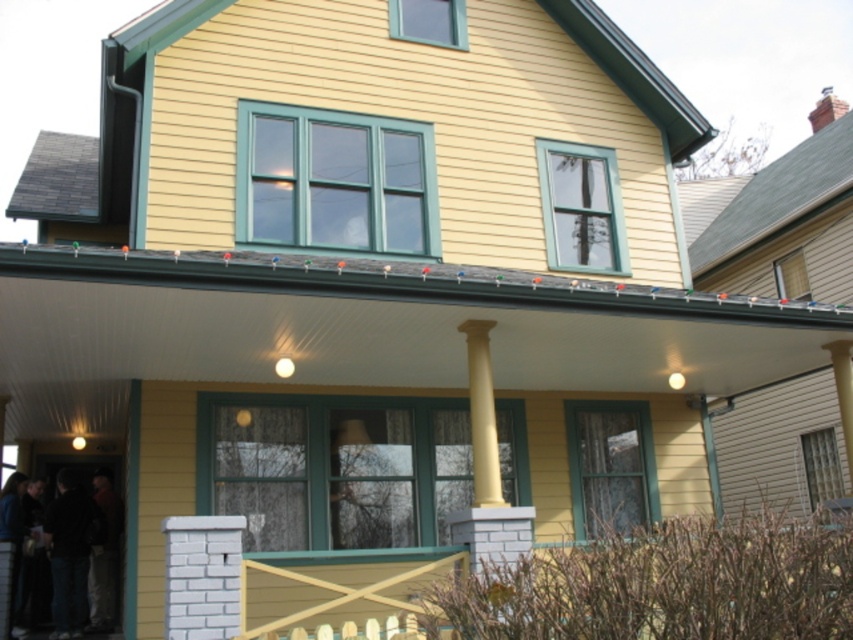
You are a guest arriving at the house and notice the dark clothing at entrance and the yellow painted wood pillar at center. Which object appears taller from your perspective?

The dark clothing at entrance appears taller than the yellow painted wood pillar at center.

You are standing in front of the house and see the point marked at coordinates (73, 548). What object is located there?

The point at coordinates (73, 548) indicates dark blue jeans at lower left.

You are a delivery person trying to place a large package on the porch of the house. The package is the size of the dark blue jeans at lower left. Can you fit it next to the yellow smooth column at center without blocking the entrance?

The dark blue jeans at lower left has a larger size compared to yellow smooth column at center. Since the package is the size of the dark blue jeans at lower left, it may not fit next to the yellow smooth column at center due to its larger size, potentially blocking the entrance.